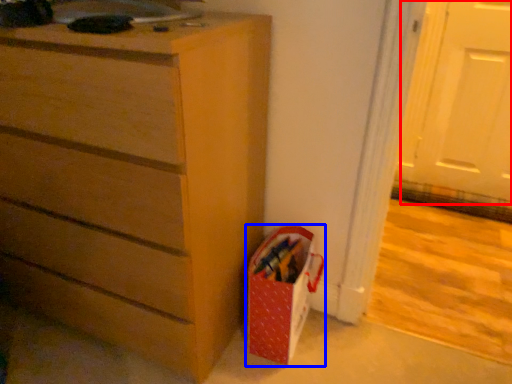
Question: Among these objects, which one is farthest to the camera, screen door (highlighted by a red box) or gift bag (highlighted by a blue box)?

Choices:
 (A) screen door
 (B) gift bag

Answer: (A)